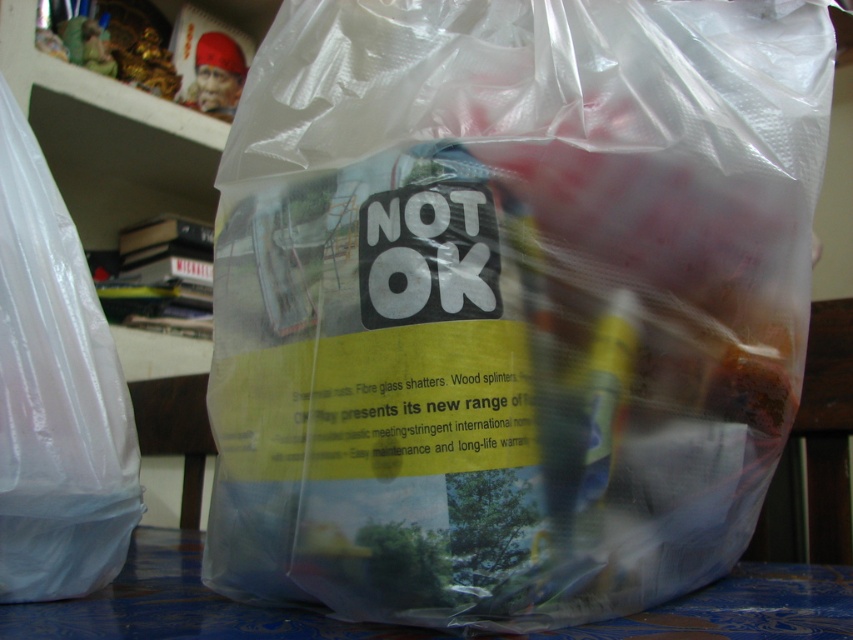
Consider the image. You are a delivery person holding a measuring tape. You need to determine if the distance from the camera to point (723,525) is more than 50 centimeters. What is your conclusion?

The distance between the camera and point (723,525) is 61.27 centimeters, which is more than 50 centimeters. Therefore, the distance is indeed more than 50 centimeters.

You are organizing a picnic and have a transparent plastic bag at center and a blue fabric table at lower center. Which item can you use to carry your snacks?

The transparent plastic bag at center is smaller in size compared to the blue fabric table at lower center, so the transparent plastic bag at center is better suited for carrying snacks as it is designed for holding items.

You are holding a camera and want to focus on the point at coordinates point (x=372, y=419). If your camera has a depth of field that can focus on objects within 15 inches to 20 inches from the lens, will the point be in focus?

The distance of point (x=372, y=419) from camera is 18.43 inches, which falls within the camera depth of field range of 15 inches to 20 inches. Therefore, the point will be in focus.